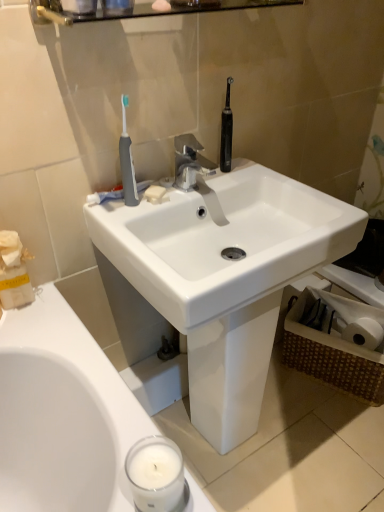
Image resolution: width=384 pixels, height=512 pixels. Find the location of `free spot to the left of silver metallic faucet at center`. free spot to the left of silver metallic faucet at center is located at coordinates (151, 198).